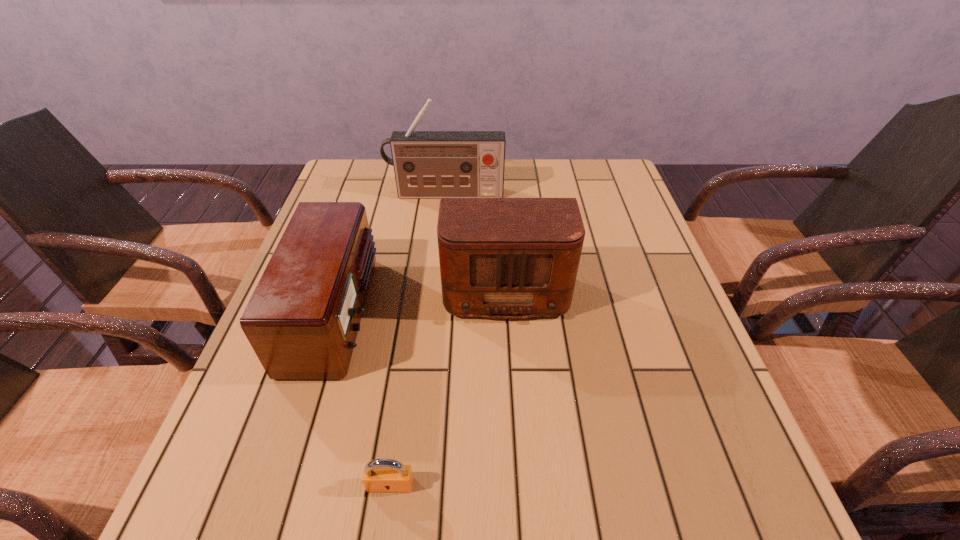
Where is `the tallest radio receiver`? The width and height of the screenshot is (960, 540). the tallest radio receiver is located at coordinates (427, 164).

Find the location of a particular element. the farthest object is located at coordinates (427, 164).

Find the location of `the second shortest radio receiver`. the second shortest radio receiver is located at coordinates (499, 257).

Locate an element on the screen. The height and width of the screenshot is (540, 960). the shortest radio receiver is located at coordinates (302, 320).

Where is `padlock`? padlock is located at coordinates (380, 475).

The width and height of the screenshot is (960, 540). I want to click on the nearest object, so click(x=380, y=475).

This screenshot has height=540, width=960. What are the coordinates of `vacant region located 0.280m on the front panel of the tallest object` in the screenshot? It's located at (439, 265).

Where is `vacant position located 0.060m on the front panel of the second tallest object`? The image size is (960, 540). vacant position located 0.060m on the front panel of the second tallest object is located at coordinates coord(509,348).

Locate an element on the screen. vacant space situated on the front-facing side of the second shortest object is located at coordinates (438, 313).

I want to click on free spot located 0.060m to unlock the nearest object from the front, so click(x=383, y=534).